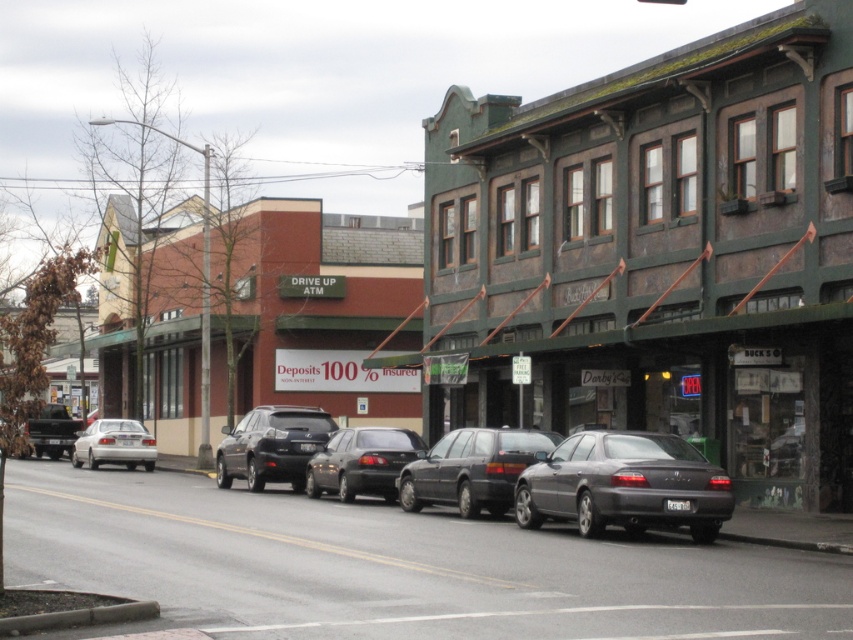
You are a delivery driver who needs to park your truck between the matte black station wagon at center and the silver metallic sedan at left. Your truck is 6 meters long. Is there enough space between them to park?

The matte black station wagon at center is 18.70 meters away from the silver metallic sedan at left. Since the truck is only 6 meters long, there is sufficient space between them to park.

You are standing at the point with coordinates 0.6, 0.6. You want to walk to the matte black station wagon at center. In which direction should you move?

You should move towards the direction of the matte black station wagon at center located at coordinates (471, 468) from your current position at (511, 384).

You are a delivery driver who needs to park your truck in the area shown in the image. The truck is 10 meters long. The parking spot you want to use is located at point 0.759, 0.733. Can you fit your truck into the parking spot at the matte gray sedan at center?

The parking spot at the matte gray sedan at center is located at point (624, 484). However, the description does not provide information about the size of the parking spot. Therefore, it is impossible to determine if the 10 meter long truck can fit there.